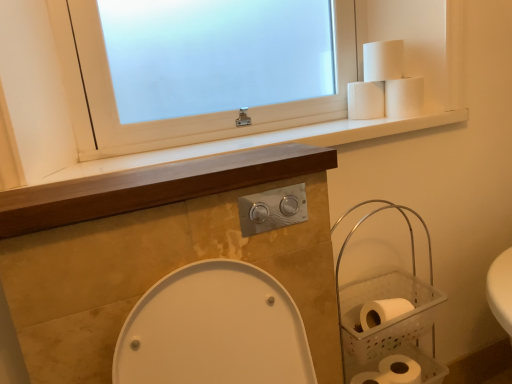
Question: Which is correct: white matte toilet paper at lower right, the 1th toilet paper in the bottom-to-top sequence, is inside clear plastic basket at right, or outside of it?

Choices:
 (A) inside
 (B) outside

Answer: (A)

Question: In terms of height, does white matte toilet paper at lower right, the 4th toilet paper positioned from the top, look taller or shorter compared to clear plastic basket at right?

Choices:
 (A) short
 (B) tall

Answer: (A)

Question: Considering the real-world distances, which object is closest to the white matte toilet paper at upper right, placed as the 1th toilet paper when sorted from top to bottom?

Choices:
 (A) clear plastic basket at right
 (B) white matte toilet paper at upper right, which is the third toilet paper in top-to-bottom order
 (C) white frosted glass window at upper center
 (D) wooden at center
 (E) white matte toilet paper at lower right, the 4th toilet paper positioned from the top

Answer: (B)

Question: Which object is the farthest from the wooden at center?

Choices:
 (A) clear plastic basket at right
 (B) white matte toilet paper at upper right, which is the third toilet paper in top-to-bottom order
 (C) white matte toilet paper at upper right, placed as the 1th toilet paper when sorted from top to bottom
 (D) white matte toilet paper at lower right, the 4th toilet paper positioned from the top
 (E) white frosted glass window at upper center

Answer: (D)